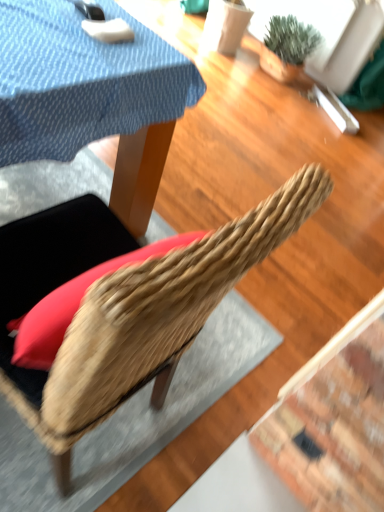
Locate an element on the screen. This screenshot has width=384, height=512. green textured plant at upper right is located at coordinates (287, 47).

Image resolution: width=384 pixels, height=512 pixels. Describe the element at coordinates (287, 47) in the screenshot. I see `green textured plant at upper right` at that location.

Locate an element on the screen. The width and height of the screenshot is (384, 512). woven wood chair at center is located at coordinates (138, 320).

What do you see at coordinates (138, 320) in the screenshot?
I see `woven wood chair at center` at bounding box center [138, 320].

Identify the location of green textured plant at upper right. The height and width of the screenshot is (512, 384). (287, 47).

Which is more to the right, green textured plant at upper right or woven wood chair at center?

green textured plant at upper right.

Considering the positions of objects green textured plant at upper right and woven wood chair at center in the image provided, who is in front, green textured plant at upper right or woven wood chair at center?

woven wood chair at center is closer to the camera.

Does point (308, 41) lie in front of point (325, 198)?

No, (308, 41) is behind (325, 198).

From the image's perspective, who appears lower, green textured plant at upper right or woven wood chair at center?

woven wood chair at center, from the image's perspective.

From a real-world perspective, is green textured plant at upper right located higher than woven wood chair at center?

No, from a real-world perspective, green textured plant at upper right is not above woven wood chair at center.

Is green textured plant at upper right wider than woven wood chair at center?

No, green textured plant at upper right is not wider than woven wood chair at center.

Considering the sizes of green textured plant at upper right and woven wood chair at center in the image, is green textured plant at upper right taller or shorter than woven wood chair at center?

green textured plant at upper right is shorter than woven wood chair at center.

Considering the sizes of objects green textured plant at upper right and woven wood chair at center in the image provided, who is smaller, green textured plant at upper right or woven wood chair at center?

green textured plant at upper right.

Is green textured plant at upper right not inside woven wood chair at center?

Yes, green textured plant at upper right is not within woven wood chair at center.

Can you see green textured plant at upper right touching woven wood chair at center?

No, green textured plant at upper right is not in contact with woven wood chair at center.

Could you tell me if green textured plant at upper right is turned towards woven wood chair at center?

Yes, green textured plant at upper right is turned towards woven wood chair at center.

The width and height of the screenshot is (384, 512). In the image, there is a woven wood chair at center. In order to click on houseplant below it (from a real-world perspective) in this screenshot , I will do `click(287, 47)`.

In the image, is woven wood chair at center on the left side or the right side of green textured plant at upper right?

Clearly, woven wood chair at center is on the left of green textured plant at upper right in the image.

Which object is further away from the camera, woven wood chair at center or green textured plant at upper right?

green textured plant at upper right.

Is point (130, 361) closer or farther from the camera than point (261, 67)?

Point (130, 361) appears to be closer to the viewer than point (261, 67).

From the image's perspective, which is below, woven wood chair at center or green textured plant at upper right?

woven wood chair at center, from the image's perspective.

From a real-world perspective, which object stands above the other?

woven wood chair at center.

In terms of width, does woven wood chair at center look wider or thinner when compared to green textured plant at upper right?

Considering their sizes, woven wood chair at center looks broader than green textured plant at upper right.

Does woven wood chair at center have a greater height compared to green textured plant at upper right?

Indeed, woven wood chair at center has a greater height compared to green textured plant at upper right.

Who is bigger, woven wood chair at center or green textured plant at upper right?

woven wood chair at center.

From the picture: Is woven wood chair at center positioned beyond the bounds of green textured plant at upper right?

Yes.

Is woven wood chair at center in contact with green textured plant at upper right?

No, woven wood chair at center is not beside green textured plant at upper right.

Is woven wood chair at center oriented away from green textured plant at upper right?

No.

Can you tell me how much woven wood chair at center and green textured plant at upper right differ in facing direction?

The facing directions of woven wood chair at center and green textured plant at upper right are 92 degrees apart.

Where is `chair lying on the left of green textured plant at upper right`? chair lying on the left of green textured plant at upper right is located at coordinates (138, 320).

The height and width of the screenshot is (512, 384). Identify the location of houseplant below the woven wood chair at center (from a real-world perspective). (287, 47).

I want to click on houseplant above the woven wood chair at center (from the image's perspective), so click(287, 47).